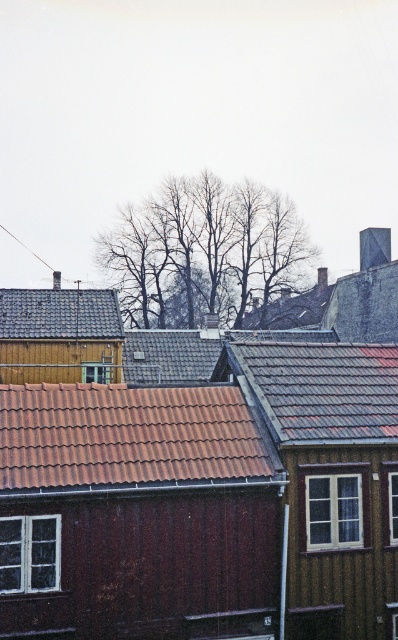
Question: Which of the following is the closest to the observer?

Choices:
 (A) brown tile roof at center
 (B) gray tile roof at center
 (C) gray slate roof at upper left

Answer: (A)

Question: Estimate the real-world distances between objects in this image. Which object is farther from the brown tile roof at center?

Choices:
 (A) gray tile roof at center
 (B) gray slate roof at upper left

Answer: (B)

Question: Can you confirm if brown tile roof at center is positioned to the left of gray slate roof at upper left?

Choices:
 (A) yes
 (B) no

Answer: (B)

Question: Which point is closer to the camera?

Choices:
 (A) brown tile roof at center
 (B) gray slate roof at upper left

Answer: (A)

Question: In this image, where is gray tile roof at center located relative to gray slate roof at upper left?

Choices:
 (A) above
 (B) below

Answer: (B)

Question: Is brown tile roof at center to the right of gray slate roof at upper left from the viewer's perspective?

Choices:
 (A) yes
 (B) no

Answer: (A)